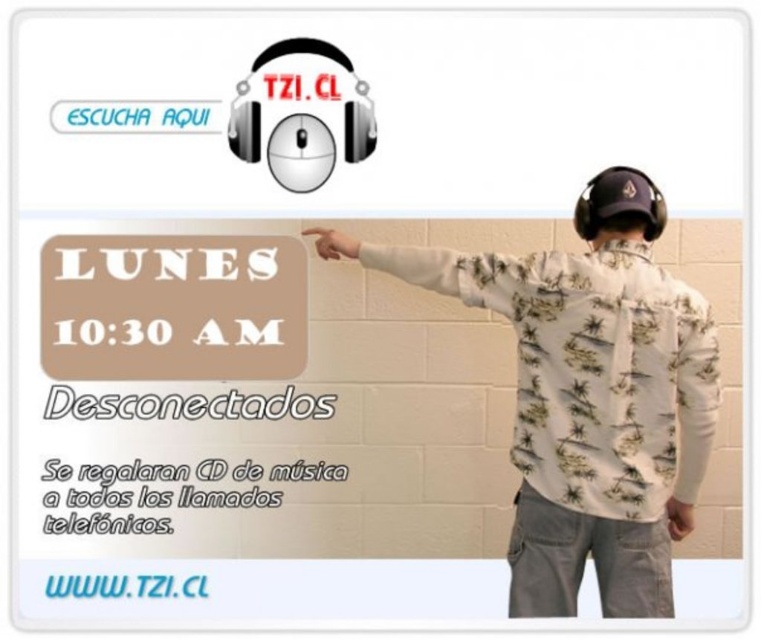
You are designing a layout for a digital ad and need to ensure that the white floral shirt at center and the black matte headphones at upper center are visible. Given their sizes, which object should be placed lower to avoid overlapping?

The white floral shirt at center is taller than the black matte headphones at upper center, so to avoid overlapping, the white floral shirt at center should be placed lower since it is taller and requires more vertical space.

You are designing a poster and want to place a sticker between the black matte headphones at upper center and the light brown leather hand at lower right. Which object should the sticker be closer to if you want it to be near the wider object?

The sticker should be closer to the black matte headphones at upper center because its width surpasses that of the light brown leather hand at lower right.

You are a graphic designer reviewing the advertisement for TZI.CL. You notice the black matte headphones at upper center and the light brown leather hand at lower right. Which object is closer to the viewer in the advertisement?

The black matte headphones at upper center are closer to the viewer than the light brown leather hand at lower right.